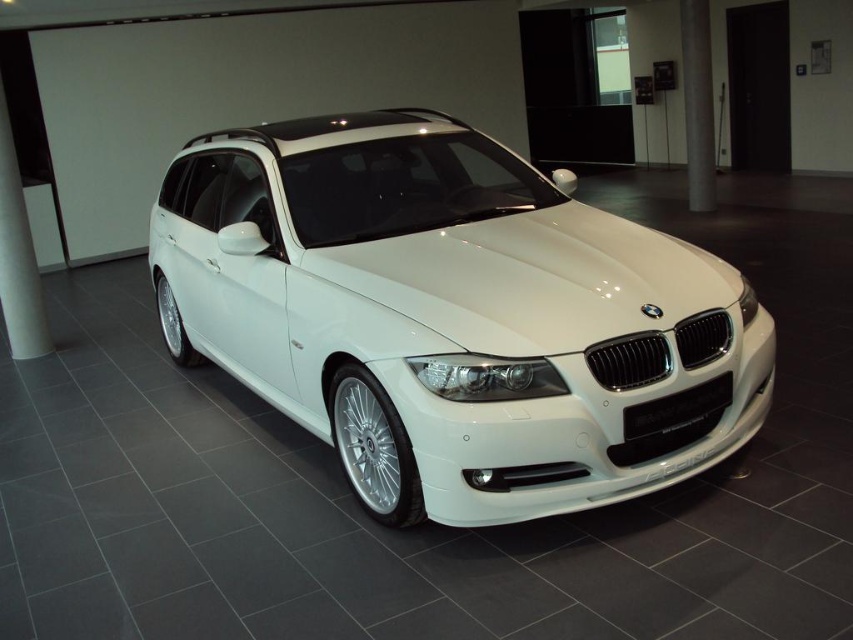
Question: Estimate the real-world distances between objects in this image. Which object is farther from the white glossy pillar at left?

Choices:
 (A) white metallic car at center
 (B) satin silver pole at center

Answer: (B)

Question: Among these points, which one is farthest from the camera?

Choices:
 (A) (703, 61)
 (B) (18, 172)
 (C) (558, 188)

Answer: (A)

Question: Where is white metallic car at center located in relation to white glossy pillar at left in the image?

Choices:
 (A) right
 (B) left

Answer: (A)

Question: Is white metallic car at center below satin silver pole at center?

Choices:
 (A) no
 (B) yes

Answer: (B)

Question: Is white glossy pillar at left to the left of satin silver pole at center from the viewer's perspective?

Choices:
 (A) no
 (B) yes

Answer: (B)

Question: Which point is closer to the camera?

Choices:
 (A) white metallic car at center
 (B) satin silver pole at center
 (C) white glossy pillar at left

Answer: (A)